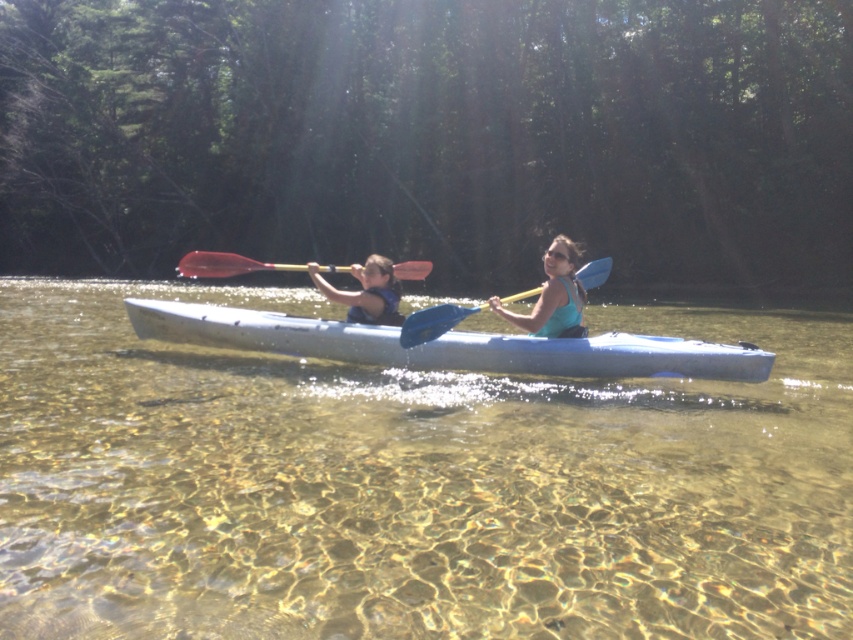
You are a lifeguard observing the scene. You notice the matte blue kayak at center and the matte blue life vest at center. Which object is closer to the front of the kayak?

The matte blue kayak at center is in front of the matte blue life vest at center, so the kayak is closer to the front.

You are standing on the shore of the lake and see two points in the water. The first point is at coordinates point [576,253] and the second is at point [381,314]. Which point is closer to you?

Point [576,253] is closer to the viewer than point [381,314].

You are planning to store the matte blue kayak at center and the red plastic paddle at center in a storage room. The storage room has a limited space. Based on the image, which object would require more storage space?

The red plastic paddle at center requires more storage space than the matte blue kayak at center because the matte blue kayak at center occupies less space than red plastic paddle at center.